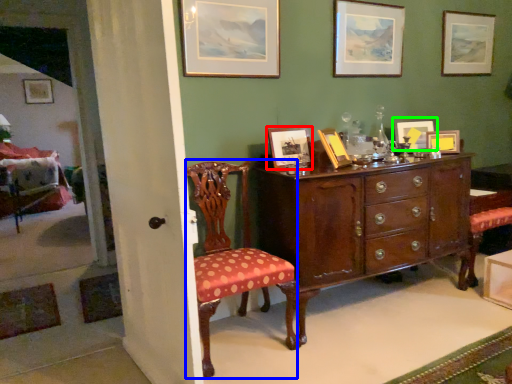
Question: Which is nearer to the picture frame (highlighted by a red box)? chair (highlighted by a blue box) or picture frame (highlighted by a green box).

Choices:
 (A) chair
 (B) picture frame

Answer: (A)